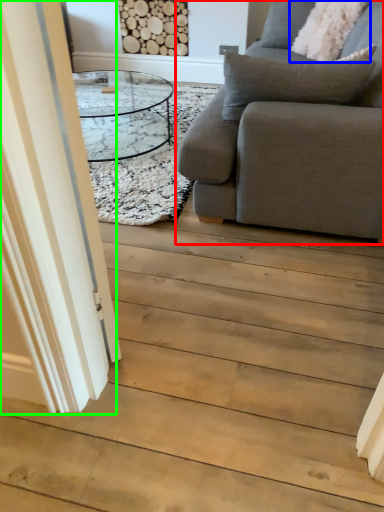
Question: Which object is the farthest from studio couch (highlighted by a red box)? Choose among these: pillow (highlighted by a blue box) or glass door (highlighted by a green box).

Choices:
 (A) pillow
 (B) glass door

Answer: (A)